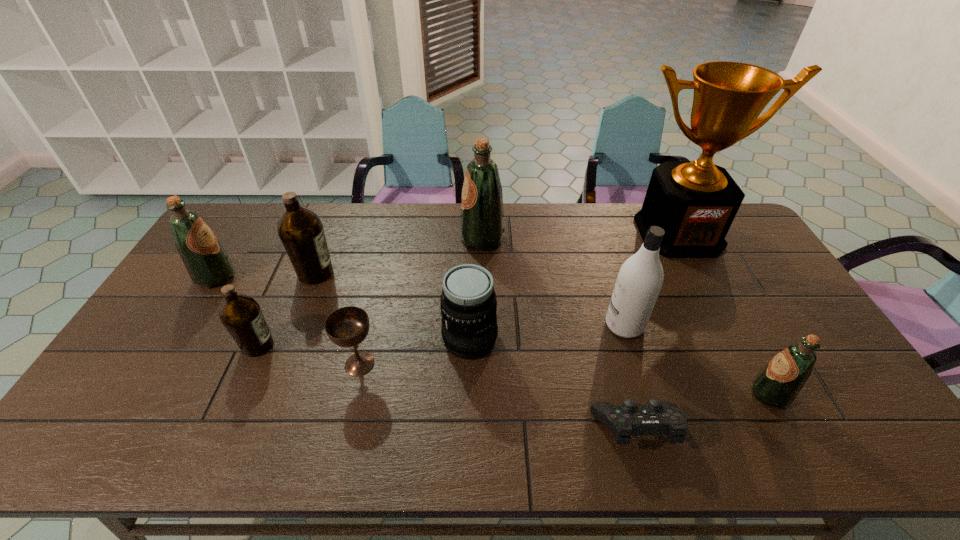
Where is `trophy cup`? The image size is (960, 540). trophy cup is located at coordinates (695, 203).

You are a GUI agent. You are given a task and a screenshot of the screen. Output one action in this format:
    pyautogui.click(x=<x>, y=<y>)
    Task: Click on the gold trophy cup
    
    Given the screenshot: What is the action you would take?
    pyautogui.click(x=695, y=203)

Identify the location of the biggest green olive oil. (482, 217).

Locate an element on the screen. the tallest olive oil is located at coordinates (482, 217).

This screenshot has width=960, height=540. What are the coordinates of `white shampoo` in the screenshot? It's located at (640, 278).

Identify the location of the leftmost olive oil. (208, 265).

This screenshot has width=960, height=540. Find the location of `the leftmost green olive oil`. the leftmost green olive oil is located at coordinates (208, 265).

I want to click on the bigger brown olive oil, so click(x=300, y=230).

The width and height of the screenshot is (960, 540). What are the coordinates of `telephoto lens` in the screenshot? It's located at (468, 305).

Where is `the rightmost green olive oil`? The width and height of the screenshot is (960, 540). the rightmost green olive oil is located at coordinates (778, 384).